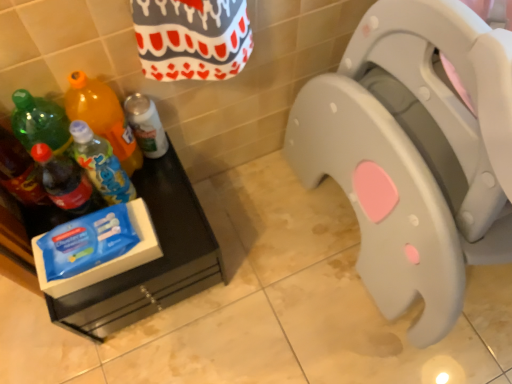
I want to click on unoccupied region to the right of blue plastic bottle at left, arranged as the fourth bottle when viewed from the left, so click(172, 210).